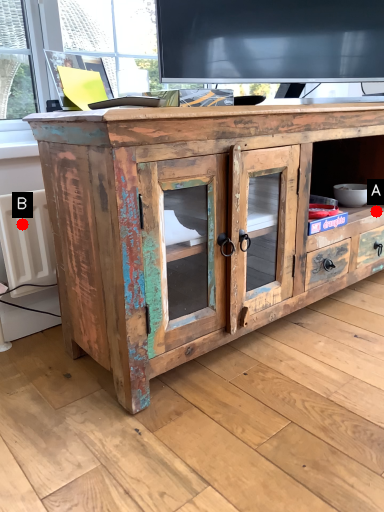
Question: Two points are circled on the image, labeled by A and B beside each circle. Which point is closer to the camera?

Choices:
 (A) A is closer
 (B) B is closer

Answer: (B)